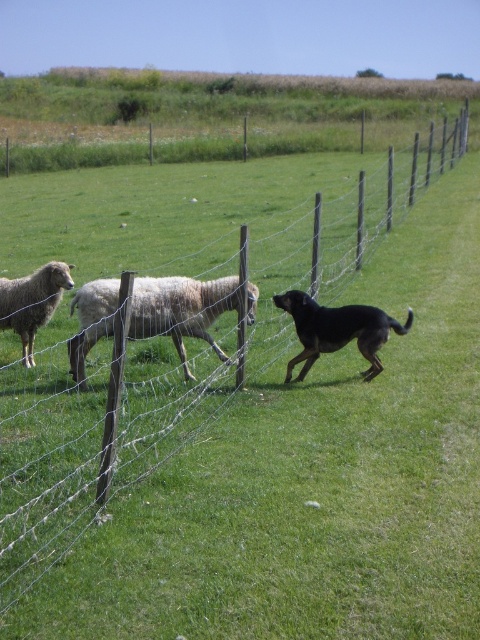
Is point (206, 332) in front of point (309, 344)?

No.

Who is positioned more to the left, white woolen sheep at center or black matte dog at center?

white woolen sheep at center is more to the left.

Is point (248, 300) more distant than point (315, 349)?

No.

Locate an element on the screen. white woolen sheep at center is located at coordinates (180, 308).

Who is positioned more to the right, black matte dog at center or white woolly sheep at left?

black matte dog at center

Is point (332, 346) positioned in front of point (47, 268)?

That is True.

Where is `black matte dog at center`? This screenshot has height=640, width=480. black matte dog at center is located at coordinates (336, 330).

Can you confirm if white woolen sheep at center is wider than white woolly sheep at left?

Indeed, white woolen sheep at center has a greater width compared to white woolly sheep at left.

Can you confirm if white woolen sheep at center is shorter than white woolly sheep at left?

Correct, white woolen sheep at center is not as tall as white woolly sheep at left.

Where is `white woolen sheep at center`? This screenshot has width=480, height=640. white woolen sheep at center is located at coordinates (180, 308).